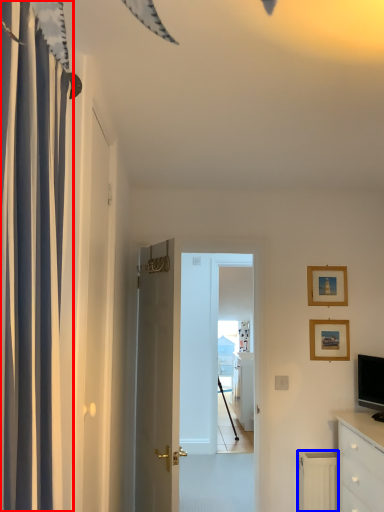
Question: Which of the following is the closest to the observer, curtain (highlighted by a red box) or radiator (highlighted by a blue box)?

Choices:
 (A) curtain
 (B) radiator

Answer: (A)